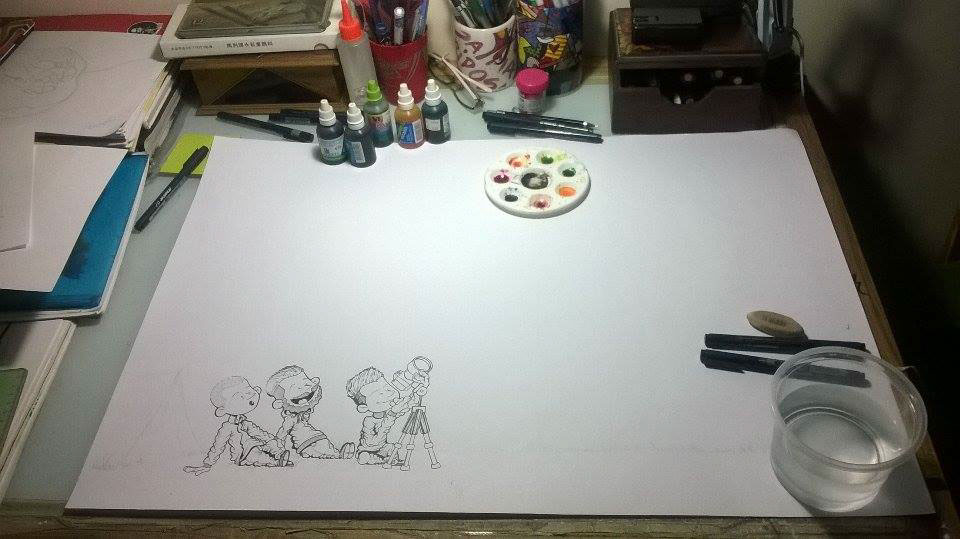
Locate an element on the screen. The image size is (960, 539). ceramic coffee mug is located at coordinates (485, 37).